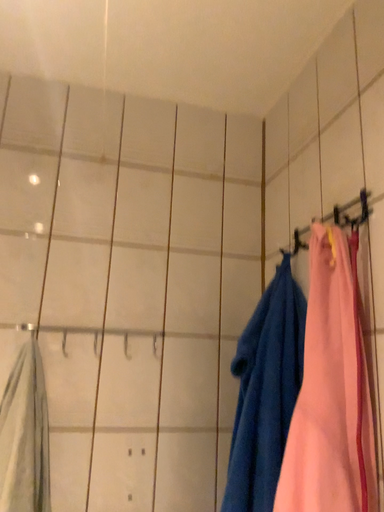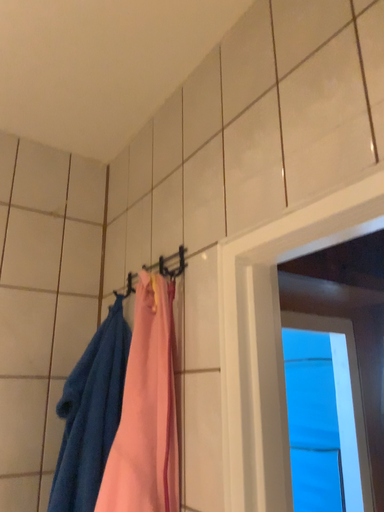
Question: Which way did the camera rotate in the video?

Choices:
 (A) rotated right
 (B) rotated left

Answer: (A)